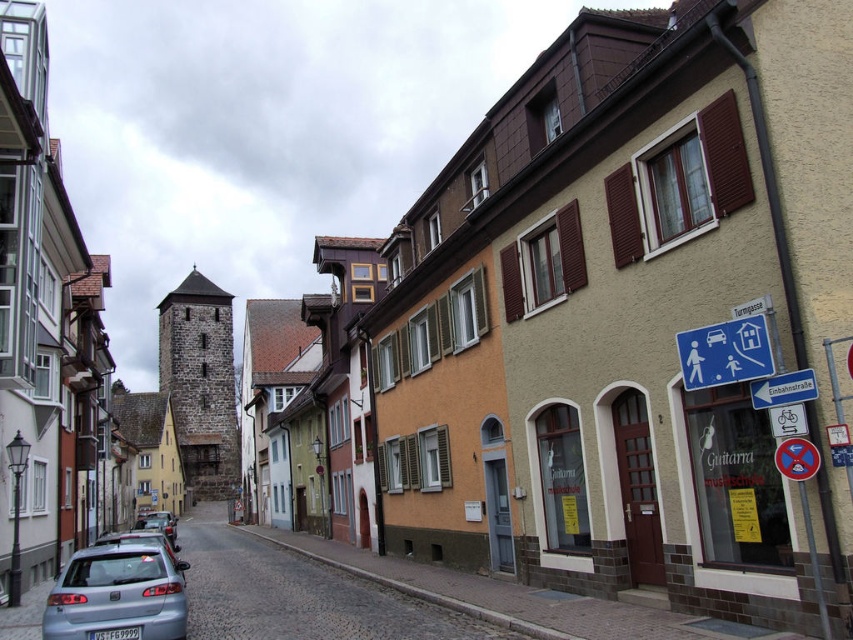
You are a delivery person needing to park your vehicle near the Guitar store. The parking spot you found is at coordinates point A. Can you determine if the metallic silver hatchback at lower left is blocking your parking spot?

The metallic silver hatchback at lower left is located at point A, so it is blocking your parking spot.

You are a pedestrian standing on the cobblestone street and want to cross to the other side. There are two cars in your path. The metallic silver hatchback at lower left and the silver metallic car at center. Which car is closer to you so you can decide which one to avoid first?

The metallic silver hatchback at lower left is located above the silver metallic car at center, meaning it is further away. Therefore, the silver metallic car at center is closer to you, so you should avoid it first.